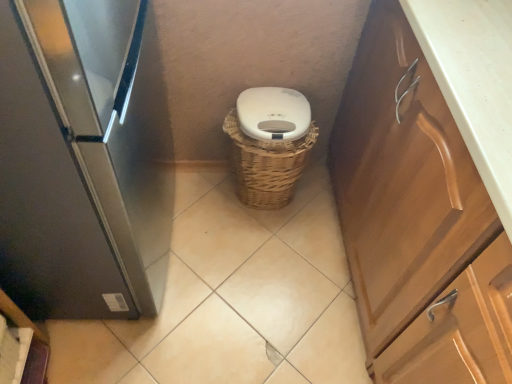
Question: Is woven brown basket at center behind white matte toilet bowl at center?

Choices:
 (A) yes
 (B) no

Answer: (B)

Question: Considering the relative sizes of woven brown basket at center and white matte toilet bowl at center in the image provided, is woven brown basket at center smaller than white matte toilet bowl at center?

Choices:
 (A) yes
 (B) no

Answer: (B)

Question: From the image's perspective, would you say woven brown basket at center is positioned over white matte toilet bowl at center?

Choices:
 (A) yes
 (B) no

Answer: (B)

Question: Can you confirm if woven brown basket at center is wider than white matte toilet bowl at center?

Choices:
 (A) yes
 (B) no

Answer: (A)

Question: Is woven brown basket at center positioned in front of white matte toilet bowl at center?

Choices:
 (A) yes
 (B) no

Answer: (A)

Question: Considering the relative positions of woven brown basket at center and white matte toilet bowl at center in the image provided, is woven brown basket at center to the right of white matte toilet bowl at center from the viewer's perspective?

Choices:
 (A) yes
 (B) no

Answer: (B)

Question: Is satin black refrigerator at left not close to wooden cabinet at right?

Choices:
 (A) no
 (B) yes

Answer: (A)

Question: Is the depth of satin black refrigerator at left greater than that of wooden cabinet at right?

Choices:
 (A) yes
 (B) no

Answer: (B)

Question: Can you confirm if satin black refrigerator at left is bigger than wooden cabinet at right?

Choices:
 (A) yes
 (B) no

Answer: (B)

Question: From a real-world perspective, is satin black refrigerator at left physically below wooden cabinet at right?

Choices:
 (A) no
 (B) yes

Answer: (A)

Question: Can you confirm if satin black refrigerator at left is shorter than wooden cabinet at right?

Choices:
 (A) yes
 (B) no

Answer: (B)

Question: Considering the relative sizes of satin black refrigerator at left and wooden cabinet at right in the image provided, is satin black refrigerator at left taller than wooden cabinet at right?

Choices:
 (A) yes
 (B) no

Answer: (A)

Question: Considering the relative positions of white matte toilet bowl at center and wooden cabinet at right in the image provided, is white matte toilet bowl at center to the right of wooden cabinet at right from the viewer's perspective?

Choices:
 (A) yes
 (B) no

Answer: (B)